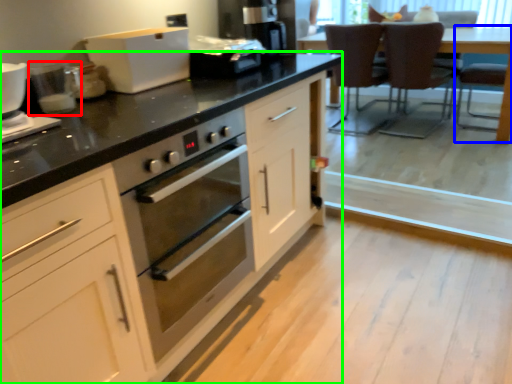
Question: Estimate the real-world distances between objects in this image. Which object is closer to kitchen appliance (highlighted by a red box), armchair (highlighted by a blue box) or cabinetry (highlighted by a green box)?

Choices:
 (A) armchair
 (B) cabinetry

Answer: (B)